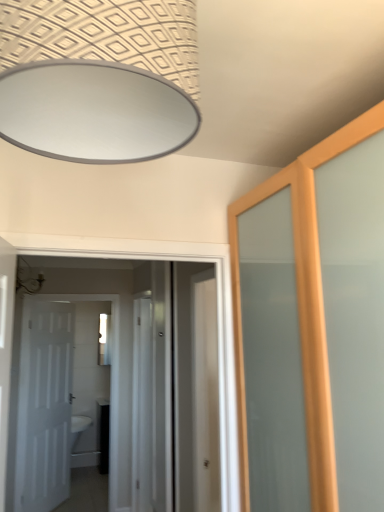
This screenshot has height=512, width=384. Describe the element at coordinates (53, 393) in the screenshot. I see `white glossy door at left, the first door viewed from the back` at that location.

Measure the distance between point (104, 356) and camera.

Point (104, 356) is 4.60 meters away from camera.

Locate an element on the screen. clear glass screen door at center is located at coordinates 142,406.

What is the approximate height of white glossy door at center, the first door viewed from the right?

The height of white glossy door at center, the first door viewed from the right, is 38.24 inches.

This screenshot has height=512, width=384. What are the coordinates of `white glossy door at left, the second door when ordered from right to left` in the screenshot? It's located at (53, 393).

Can you confirm if white glossy door at center, acting as the 2th door starting from the back, is wider than clear glass mirror at center?

Yes.

Looking at this image, measure the distance from white glossy door at center, acting as the 2th door starting from the back, to clear glass mirror at center.

white glossy door at center, acting as the 2th door starting from the back, and clear glass mirror at center are 74.20 centimeters apart.

Where is `mirror lying below the white glossy door at center, acting as the 2th door starting from the back (from the image's perspective)`? This screenshot has width=384, height=512. mirror lying below the white glossy door at center, acting as the 2th door starting from the back (from the image's perspective) is located at coordinates (104, 340).

Considering the sizes of objects white glossy door at center, the first door viewed from the right, and clear glass mirror at center in the image provided, who is taller, white glossy door at center, the first door viewed from the right, or clear glass mirror at center?

Standing taller between the two is white glossy door at center, the first door viewed from the right.

Who is taller, white glossy door at left, the second door when ordered from right to left, or clear glass screen door at center?

Standing taller between the two is clear glass screen door at center.

Which of these two, white glossy door at left, the 1th door viewed from the left, or clear glass screen door at center, is wider?

Wider between the two is clear glass screen door at center.

From a real-world perspective, is white glossy door at left, the first door viewed from the back, positioned above or below clear glass screen door at center?

Clearly, from a real-world perspective, white glossy door at left, the first door viewed from the back, is above clear glass screen door at center.

In the scene shown: Could you tell me if white glossy door at left, the 1th door viewed from the left, is turned towards clear glass screen door at center?

No, white glossy door at left, the 1th door viewed from the left, is not turned towards clear glass screen door at center.

Can we say white glossy door at left, the 1th door viewed from the left, lies outside clear glass mirror at center?

Absolutely, white glossy door at left, the 1th door viewed from the left, is external to clear glass mirror at center.

From a real-world perspective, is white glossy door at left, arranged as the second door when viewed from the front, located beneath clear glass mirror at center?

Indeed, from a real-world perspective, white glossy door at left, arranged as the second door when viewed from the front, is positioned beneath clear glass mirror at center.

From the image's perspective, relative to clear glass mirror at center, is white glossy door at left, the second door when ordered from right to left, above or below?

Based on their image positions, white glossy door at left, the second door when ordered from right to left, is located beneath clear glass mirror at center.

Is white glossy door at left, the 1th door viewed from the left, oriented away from clear glass mirror at center?

Yes, white glossy door at left, the 1th door viewed from the left, is positioned with its back facing clear glass mirror at center.

Considering the sizes of objects clear glass mirror at center and clear glass screen door at center in the image provided, who is bigger, clear glass mirror at center or clear glass screen door at center?

clear glass screen door at center is bigger.

Could you tell me if clear glass mirror at center is turned towards clear glass screen door at center?

Yes.

Would you say clear glass mirror at center is inside or outside clear glass screen door at center?

clear glass mirror at center cannot be found inside clear glass screen door at center.

Is clear glass mirror at center thinner than clear glass screen door at center?

Indeed, clear glass mirror at center has a lesser width compared to clear glass screen door at center.

Considering their positions, is clear glass screen door at center located in front of or behind clear glass mirror at center?

clear glass screen door at center is in front of clear glass mirror at center.

This screenshot has height=512, width=384. In order to click on screen door that is under the clear glass mirror at center (from a real-world perspective) in this screenshot , I will do `click(142, 406)`.

Is clear glass mirror at center at the back of clear glass screen door at center?

No, clear glass screen door at center is not facing the opposite direction of clear glass mirror at center.

From a real-world perspective, is clear glass screen door at center physically located above or below clear glass mirror at center?

Clearly, from a real-world perspective, clear glass screen door at center is below clear glass mirror at center.

Looking at this image, is white glossy door at left, the second door when ordered from right to left, far away from white glossy door at center, the first door viewed from the right?

That's not correct — white glossy door at left, the second door when ordered from right to left, is a little close to white glossy door at center, the first door viewed from the right.

In the scene shown: Does white glossy door at left, the 1th door viewed from the left, have a lesser width compared to white glossy door at center, the first door viewed from the right?

Yes, white glossy door at left, the 1th door viewed from the left, is thinner than white glossy door at center, the first door viewed from the right.

Which is more to the left, white glossy door at left, the second door when ordered from right to left, or white glossy door at center, which appears as the first door when viewed from the front?

Positioned to the left is white glossy door at left, the second door when ordered from right to left.

Considering the sizes of objects white glossy door at center, acting as the 2th door starting from the back, and white glossy door at left, the first door viewed from the back, in the image provided, who is smaller, white glossy door at center, acting as the 2th door starting from the back, or white glossy door at left, the first door viewed from the back,?

Smaller between the two is white glossy door at center, acting as the 2th door starting from the back.

This screenshot has height=512, width=384. Identify the location of door below the white glossy door at center, acting as the 2th door starting from the back (from the image's perspective). (53, 393).

Which of these two, white glossy door at center, acting as the 2th door starting from the back, or white glossy door at left, the second door when ordered from right to left, is thinner?

white glossy door at left, the second door when ordered from right to left.

Find the location of a particular element. The height and width of the screenshot is (512, 384). mirror that is below the white glossy door at center, the second door viewed from the left (from the image's perspective) is located at coordinates tap(104, 340).

Locate an element on the screen. Image resolution: width=384 pixels, height=512 pixels. screen door on the right of the white glossy door at left, the first door viewed from the back is located at coordinates (142, 406).

Based on their spatial positions, is white glossy door at center, the second door viewed from the left, or white glossy door at left, the second door when ordered from right to left, further from clear glass screen door at center?

The object further to clear glass screen door at center is white glossy door at left, the second door when ordered from right to left.

When comparing their distances from clear glass screen door at center, does white glossy door at left, the 1th door viewed from the left, or clear glass mirror at center seem closer?

white glossy door at left, the 1th door viewed from the left, lies closer to clear glass screen door at center than the other object.

Which object lies nearer to the anchor point white glossy door at left, the 1th door viewed from the left, clear glass screen door at center or white glossy door at center, the second door viewed from the left?

white glossy door at center, the second door viewed from the left, lies closer to white glossy door at left, the 1th door viewed from the left, than the other object.

Considering their positions, is white glossy door at left, the second door when ordered from right to left, positioned closer to white glossy door at center, which appears as the first door when viewed from the front, than clear glass mirror at center?

white glossy door at left, the second door when ordered from right to left, lies closer to white glossy door at center, which appears as the first door when viewed from the front, than the other object.

In the scene shown: Based on their spatial positions, is white glossy door at center, acting as the 2th door starting from the back, or white glossy door at left, the first door viewed from the back, closer to clear glass mirror at center?

white glossy door at left, the first door viewed from the back.

When comparing their distances from white glossy door at center, the first door viewed from the right, does clear glass mirror at center or clear glass screen door at center seem further?

clear glass mirror at center is positioned further to the anchor white glossy door at center, the first door viewed from the right.

Estimate the real-world distances between objects in this image. Which object is closer to white glossy door at center, the first door viewed from the right, clear glass screen door at center or clear glass mirror at center?

clear glass screen door at center is positioned closer to the anchor white glossy door at center, the first door viewed from the right.

From the image, which object appears to be farther from clear glass mirror at center, white glossy door at left, arranged as the second door when viewed from the front, or clear glass screen door at center?

clear glass screen door at center lies further to clear glass mirror at center than the other object.

Find the location of a particular element. Image resolution: width=384 pixels, height=512 pixels. door between clear glass screen door at center and clear glass mirror at center in the front-back direction is located at coordinates (53, 393).

The image size is (384, 512). I want to click on screen door positioned between white glossy door at center, which appears as the first door when viewed from the front, and clear glass mirror at center from near to far, so click(x=142, y=406).

What are the coordinates of `screen door positioned between white glossy door at center, acting as the 2th door starting from the back, and white glossy door at left, the second door when ordered from right to left, from near to far` in the screenshot? It's located at click(142, 406).

What are the coordinates of `door located between white glossy door at center, the second door viewed from the left, and clear glass mirror at center in the depth direction` in the screenshot? It's located at (53, 393).